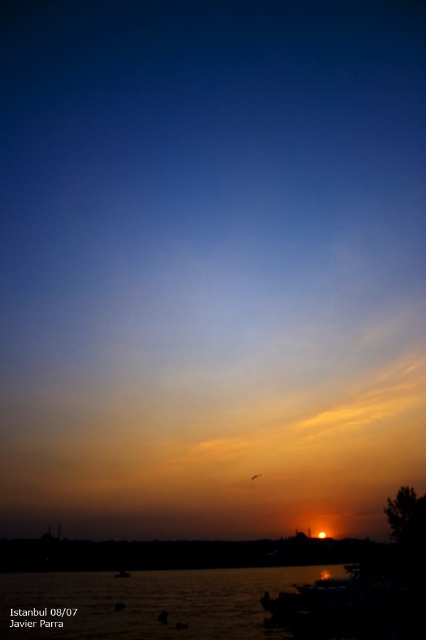
Question: Among these points, which one is nearest to the camera?

Choices:
 (A) (166, 609)
 (B) (331, 604)

Answer: (B)

Question: Does silvery reflective water at lower center lie in front of metallic silver boat at lower center?

Choices:
 (A) yes
 (B) no

Answer: (B)

Question: Which of the following is the closest to the observer?

Choices:
 (A) silvery reflective water at lower center
 (B) metallic silver boat at lower center

Answer: (B)

Question: Can you confirm if silvery reflective water at lower center is positioned above metallic silver boat at lower center?

Choices:
 (A) yes
 (B) no

Answer: (B)

Question: Is silvery reflective water at lower center to the left of metallic silver boat at lower center from the viewer's perspective?

Choices:
 (A) yes
 (B) no

Answer: (A)

Question: Which point appears closest to the camera in this image?

Choices:
 (A) (317, 586)
 (B) (209, 573)

Answer: (A)